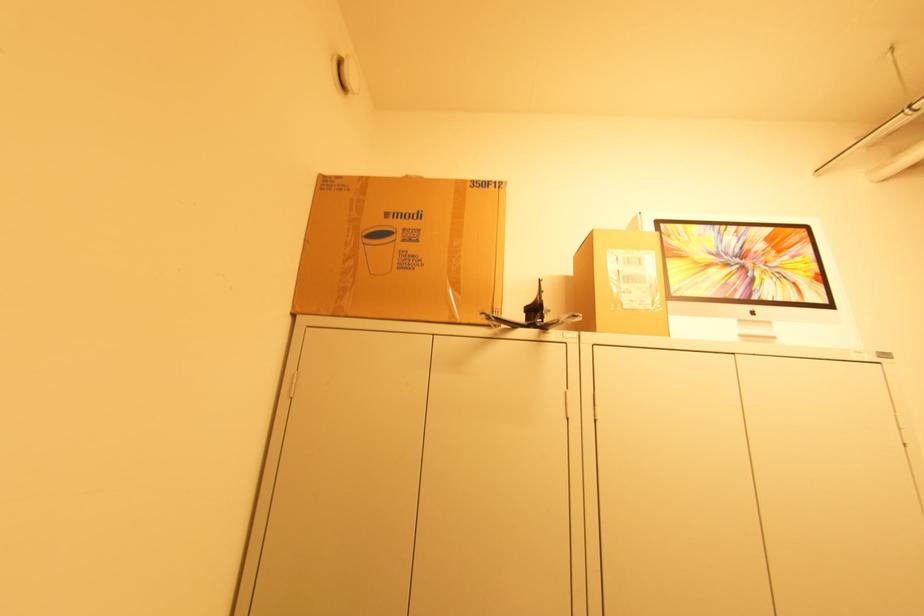
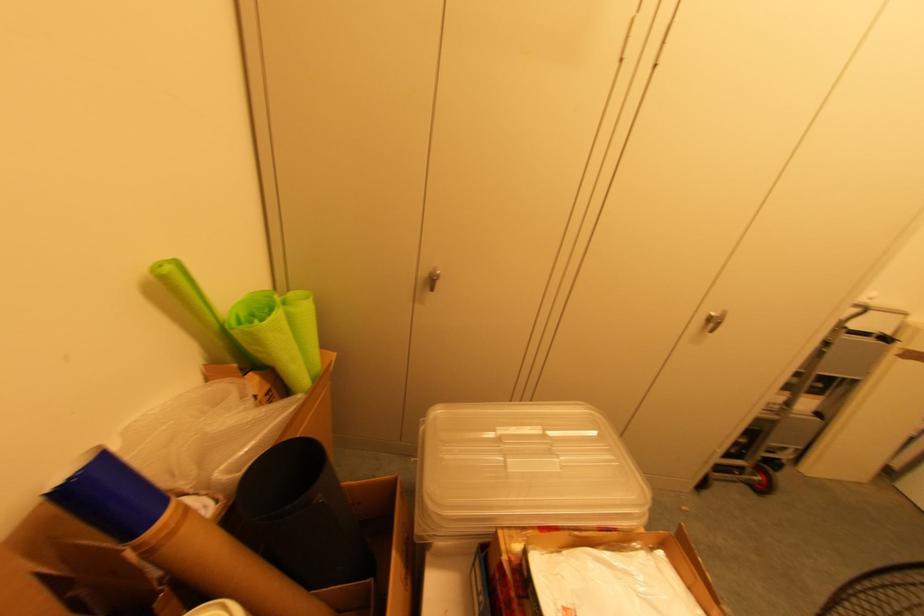
Question: The first image is from the beginning of the video and the second image is from the end. How did the camera likely rotate when shooting the video?

Choices:
 (A) Left
 (B) Right
 (C) Up
 (D) Down

Answer: (D)